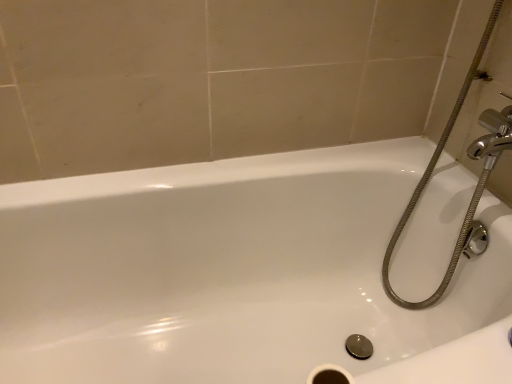
Image resolution: width=512 pixels, height=384 pixels. What do you see at coordinates (239, 274) in the screenshot?
I see `white glossy bathtub at center` at bounding box center [239, 274].

The height and width of the screenshot is (384, 512). In order to click on white glossy bathtub at center in this screenshot , I will do `click(239, 274)`.

I want to click on white glossy bathtub at center, so 239,274.